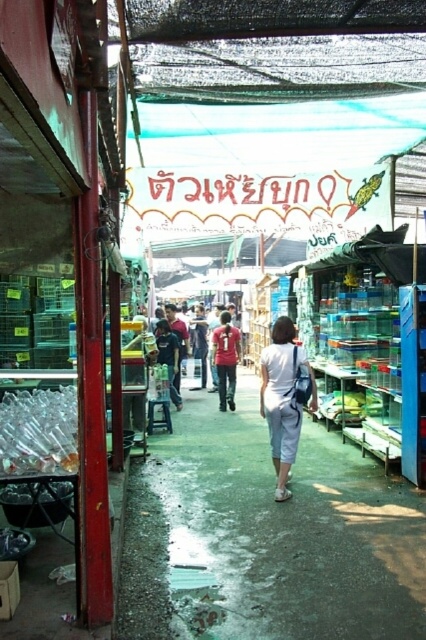
Does point (324, 490) come farther from viewer compared to point (290, 442)?

Yes, point (324, 490) is farther from viewer.

In the scene shown: Who is positioned more to the left, concrete floor at center or white cotton pants at center?

From the viewer's perspective, concrete floor at center appears more on the left side.

Is point (394, 592) positioned before point (267, 385)?

Yes, it is.

At what (x,y) coordinates should I click in order to perform the action: click on concrete floor at center. Please return your answer as a coordinate pair (x, y). This screenshot has height=640, width=426. Looking at the image, I should click on (267, 538).

Measure the distance from concrete floor at center to red matte shirt at center.

concrete floor at center is 6.29 meters away from red matte shirt at center.

You are a GUI agent. You are given a task and a screenshot of the screen. Output one action in this format:
    pyautogui.click(x=<x>, y=<y>)
    Task: Click on the concrete floor at center
    
    Given the screenshot: What is the action you would take?
    pyautogui.click(x=267, y=538)

Is point (322, 468) closer to viewer compared to point (213, 355)?

Yes, it is in front of point (213, 355).

The height and width of the screenshot is (640, 426). Identify the location of concrete floor at center. (267, 538).

Who is more forward, (293, 332) or (213, 330)?

Point (293, 332)

Is point (287, 316) behind point (232, 342)?

That is True.

The width and height of the screenshot is (426, 640). What are the coordinates of `white cotton pants at center` in the screenshot? It's located at (284, 397).